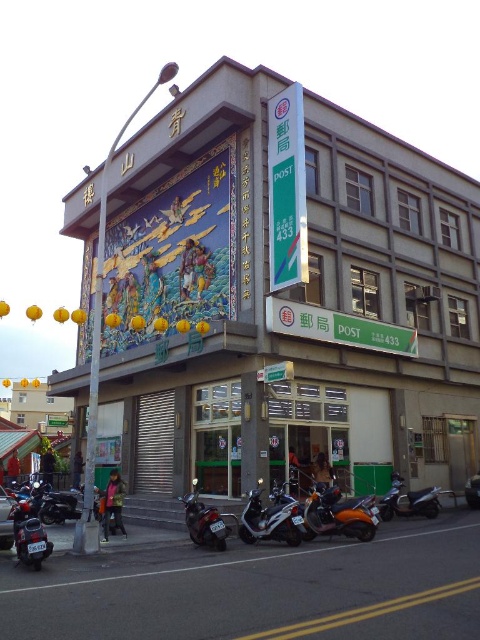
Question: Is matte gray building at center smaller than shiny metallic motorcycle at lower right?

Choices:
 (A) no
 (B) yes

Answer: (A)

Question: Among these points, which one is nearest to the camera?

Choices:
 (A) (325, 488)
 (B) (347, 301)

Answer: (A)

Question: Does metallic silver scooter at center appear on the left side of shiny black motorcycle at lower left?

Choices:
 (A) no
 (B) yes

Answer: (A)

Question: Is matte black motorcycle at lower left bigger than shiny metallic motorcycle at lower right?

Choices:
 (A) no
 (B) yes

Answer: (A)

Question: Which of these objects is positioned closest to the shiny black motorcycle at lower left?

Choices:
 (A) shiny metallic motorcycle at lower right
 (B) metallic silver scooter at center
 (C) orange matte/metallic motorcycle at lower center

Answer: (B)

Question: Among these points, which one is nearest to the camera?

Choices:
 (A) (436, 486)
 (B) (257, 538)
 (C) (389, 221)
 (D) (20, 531)

Answer: (D)